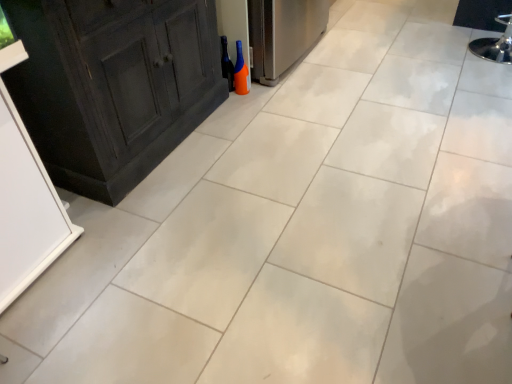
The width and height of the screenshot is (512, 384). Identify the location of vacant area located to the right-hand side of orange matte bottle at center. (273, 85).